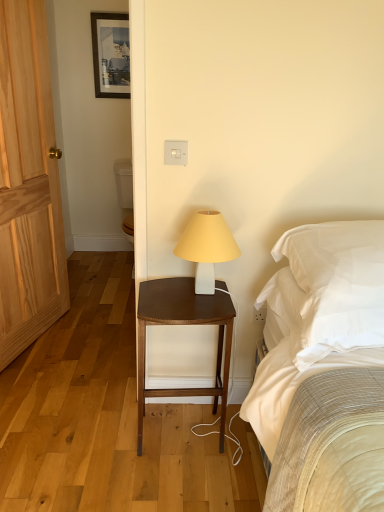
Question: From a real-world perspective, is white soft pillow at right positioned over brown wood nightstand at center based on gravity?

Choices:
 (A) no
 (B) yes

Answer: (B)

Question: Is white soft pillow at right smaller than brown wood nightstand at center?

Choices:
 (A) no
 (B) yes

Answer: (A)

Question: Considering the relative sizes of white soft pillow at right and brown wood nightstand at center in the image provided, is white soft pillow at right shorter than brown wood nightstand at center?

Choices:
 (A) no
 (B) yes

Answer: (B)

Question: Does white soft pillow at right appear on the left side of brown wood nightstand at center?

Choices:
 (A) no
 (B) yes

Answer: (A)

Question: Could brown wood nightstand at center be considered to be inside white soft pillow at right?

Choices:
 (A) yes
 (B) no

Answer: (B)

Question: From their relative heights in the image, would you say light wood door at left is taller or shorter than white matte lamp at center?

Choices:
 (A) tall
 (B) short

Answer: (A)

Question: Would you say light wood door at left is to the left or to the right of white matte lamp at center in the picture?

Choices:
 (A) right
 (B) left

Answer: (B)

Question: In the image, is light wood door at left positioned in front of or behind white matte lamp at center?

Choices:
 (A) behind
 (B) front

Answer: (A)

Question: Based on their sizes in the image, would you say light wood door at left is bigger or smaller than white matte lamp at center?

Choices:
 (A) small
 (B) big

Answer: (B)

Question: Is white soft pillow at right bigger or smaller than matte black picture frame at upper center?

Choices:
 (A) big
 (B) small

Answer: (A)

Question: Does point (304, 275) appear closer or farther from the camera than point (120, 78)?

Choices:
 (A) closer
 (B) farther

Answer: (A)

Question: From the image's perspective, is white soft pillow at right above or below matte black picture frame at upper center?

Choices:
 (A) below
 (B) above

Answer: (A)

Question: Is white soft pillow at right wider or thinner than matte black picture frame at upper center?

Choices:
 (A) thin
 (B) wide

Answer: (B)

Question: Is brown wood nightstand at center situated inside white matte lamp at center or outside?

Choices:
 (A) outside
 (B) inside

Answer: (A)

Question: From a real-world perspective, is brown wood nightstand at center physically located above or below white matte lamp at center?

Choices:
 (A) below
 (B) above

Answer: (A)